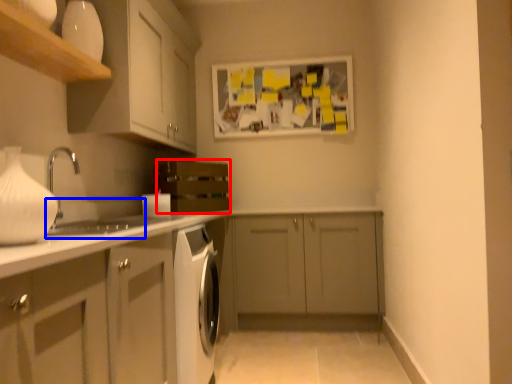
Question: Among these objects, which one is farthest to the camera, oven (highlighted by a red box) or sink (highlighted by a blue box)?

Choices:
 (A) oven
 (B) sink

Answer: (A)